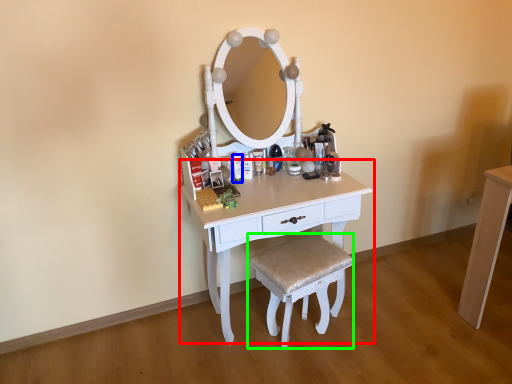
Question: Which object is the closest to the table (highlighted by a red box)? Choose among these: toiletry (highlighted by a blue box) or stool (highlighted by a green box).

Choices:
 (A) toiletry
 (B) stool

Answer: (B)